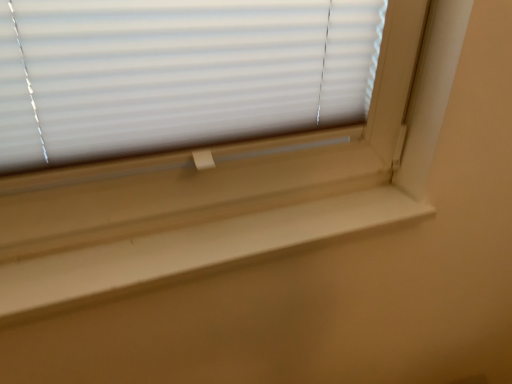
Question: From a real-world perspective, is white matte blinds at upper center positioned above or below white smooth window sill at center?

Choices:
 (A) below
 (B) above

Answer: (B)

Question: Considering the positions of white matte blinds at upper center and white smooth window sill at center in the image, is white matte blinds at upper center taller or shorter than white smooth window sill at center?

Choices:
 (A) short
 (B) tall

Answer: (B)

Question: Is white matte blinds at upper center inside or outside of white smooth window sill at center?

Choices:
 (A) outside
 (B) inside

Answer: (A)

Question: In terms of height, does white smooth window sill at center look taller or shorter compared to white matte blinds at upper center?

Choices:
 (A) tall
 (B) short

Answer: (B)

Question: Do you think white smooth window sill at center is within white matte blinds at upper center, or outside of it?

Choices:
 (A) inside
 (B) outside

Answer: (B)

Question: Looking at their shapes, would you say white smooth window sill at center is wider or thinner than white matte blinds at upper center?

Choices:
 (A) wide
 (B) thin

Answer: (A)

Question: In terms of size, does white smooth window sill at center appear bigger or smaller than white matte blinds at upper center?

Choices:
 (A) big
 (B) small

Answer: (A)